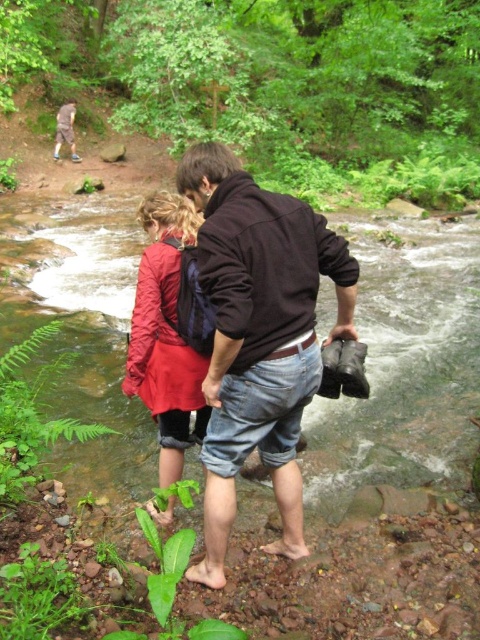
Question: Is matte red jacket at center positioned behind brown leather jacket at upper left?

Choices:
 (A) yes
 (B) no

Answer: (B)

Question: Considering the real-world distances, which object is farthest from the green leafy forest at upper center?

Choices:
 (A) clear water stream at center
 (B) brown cotton jacket at center
 (C) matte red jacket at center
 (D) brown leather jacket at upper left

Answer: (C)

Question: Which is nearer to the matte red jacket at center?

Choices:
 (A) brown cotton jacket at center
 (B) brown leather jacket at upper left
 (C) green leafy forest at upper center
 (D) clear water stream at center

Answer: (A)

Question: Observing the image, what is the correct spatial positioning of clear water stream at center in reference to matte red jacket at center?

Choices:
 (A) left
 (B) right

Answer: (B)

Question: Is clear water stream at center below brown cotton jacket at center?

Choices:
 (A) yes
 (B) no

Answer: (B)

Question: Which point appears farthest from the camera in this image?

Choices:
 (A) (118, 467)
 (B) (169, 513)

Answer: (A)